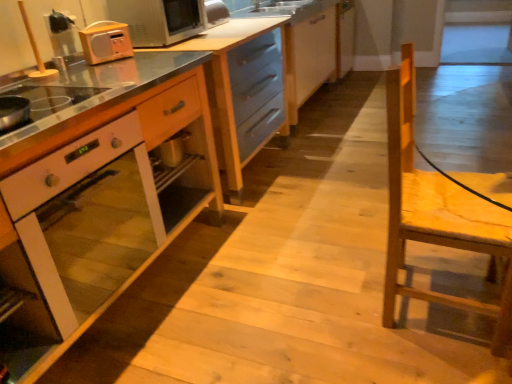
Question: Is wooden cabinet at center, which is the second cabinetry from left to right, positioned before matte orange radio at upper left?

Choices:
 (A) yes
 (B) no

Answer: (A)

Question: From the image's perspective, is wooden cabinet at center, which is the second cabinetry in right-to-left order, located above matte orange radio at upper left?

Choices:
 (A) no
 (B) yes

Answer: (A)

Question: Is wooden cabinet at center, which is the second cabinetry in right-to-left order, oriented towards matte orange radio at upper left?

Choices:
 (A) no
 (B) yes

Answer: (A)

Question: Is wooden cabinet at center, which is the second cabinetry in right-to-left order, thinner than matte orange radio at upper left?

Choices:
 (A) no
 (B) yes

Answer: (A)

Question: Does wooden cabinet at center, which is the second cabinetry from left to right, have a smaller size compared to matte orange radio at upper left?

Choices:
 (A) yes
 (B) no

Answer: (B)

Question: Is wooden cabinet at center, which is the second cabinetry from left to right, next to matte orange radio at upper left and touching it?

Choices:
 (A) yes
 (B) no

Answer: (B)

Question: Is the surface of white glossy oven at center in direct contact with wooden cabinet at center, positioned as the 3th cabinetry in left-to-right order?

Choices:
 (A) no
 (B) yes

Answer: (A)

Question: Does white glossy oven at center come behind wooden cabinet at center, arranged as the 1th cabinetry when viewed from the right?

Choices:
 (A) no
 (B) yes

Answer: (A)

Question: Are white glossy oven at center and wooden cabinet at center, arranged as the 1th cabinetry when viewed from the right, located far from each other?

Choices:
 (A) yes
 (B) no

Answer: (A)

Question: Can you confirm if white glossy oven at center is taller than wooden cabinet at center, arranged as the 1th cabinetry when viewed from the right?

Choices:
 (A) yes
 (B) no

Answer: (A)

Question: Is white glossy oven at center facing away from wooden cabinet at center, positioned as the 3th cabinetry in left-to-right order?

Choices:
 (A) yes
 (B) no

Answer: (B)

Question: From the image's perspective, is white glossy oven at center below wooden cabinet at center, positioned as the 3th cabinetry in left-to-right order?

Choices:
 (A) no
 (B) yes

Answer: (B)

Question: Is metallic silver microwave at upper left wider than wooden cabinet at center, which is the second cabinetry in right-to-left order?

Choices:
 (A) yes
 (B) no

Answer: (B)